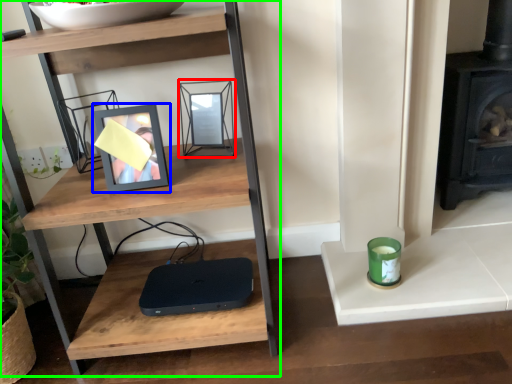
Question: Which object is positioned closest to picture frame (highlighted by a red box)? Select from picture frame (highlighted by a blue box) and shelf (highlighted by a green box).

Choices:
 (A) picture frame
 (B) shelf

Answer: (A)